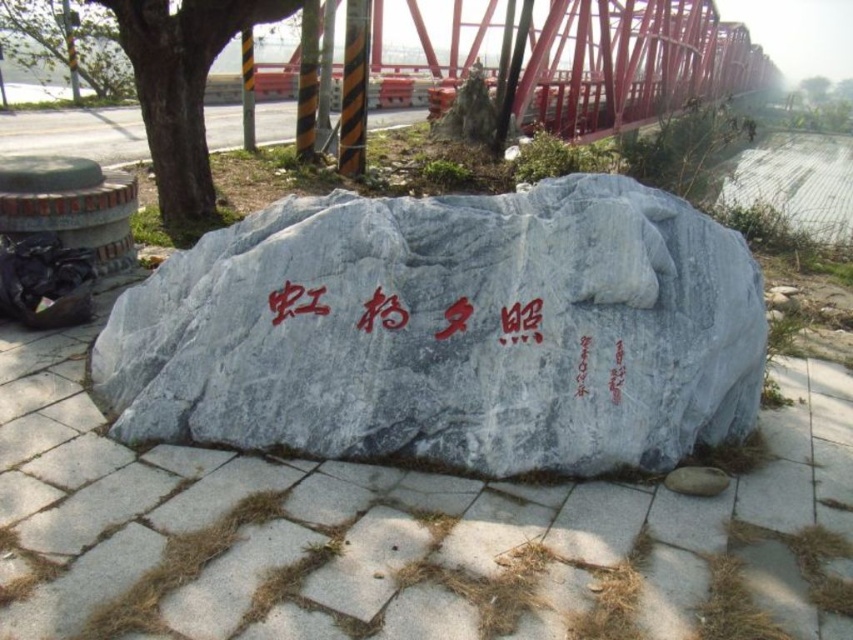
Does gray polished stone boulder at center appear on the left side of green leafy tree at left?

No, gray polished stone boulder at center is not to the left of green leafy tree at left.

Is gray polished stone boulder at center closer to the viewer compared to green leafy tree at left?

Yes.

Between point (543, 419) and point (192, 38), which one is positioned in front?

Point (543, 419) is more forward.

The width and height of the screenshot is (853, 640). In order to click on gray polished stone boulder at center in this screenshot , I will do `click(450, 332)`.

Consider the image. Can you confirm if gray polished stone boulder at center is smaller than red stone writing at center?

Actually, gray polished stone boulder at center might be larger than red stone writing at center.

Based on the photo, between gray polished stone boulder at center and red stone writing at center, which one appears on the left side from the viewer's perspective?

gray polished stone boulder at center

Between point (426, 266) and point (608, 385), which one is positioned in front?

Point (608, 385) is in front.

Where is `gray polished stone boulder at center`? This screenshot has height=640, width=853. gray polished stone boulder at center is located at coordinates pyautogui.click(x=450, y=332).

Which is in front, point (352, 550) or point (585, 358)?

Point (352, 550) is more forward.

Is gray stone pavement at center smaller than red stone writing at center?

Actually, gray stone pavement at center might be larger than red stone writing at center.

Is point (840, 573) positioned behind point (541, 332)?

That is False.

You are a GUI agent. You are given a task and a screenshot of the screen. Output one action in this format:
    pyautogui.click(x=<x>, y=<y>)
    Task: Click on the gray stone pavement at center
    This screenshot has height=640, width=853.
    Given the screenshot: What is the action you would take?
    pyautogui.click(x=392, y=532)